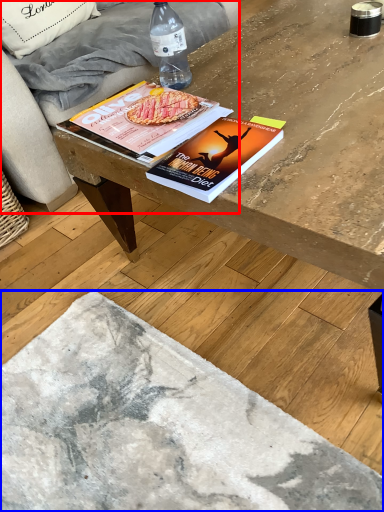
Question: Among these objects, which one is nearest to the camera, studio couch (highlighted by a red box) or concrete (highlighted by a blue box)?

Choices:
 (A) studio couch
 (B) concrete

Answer: (B)